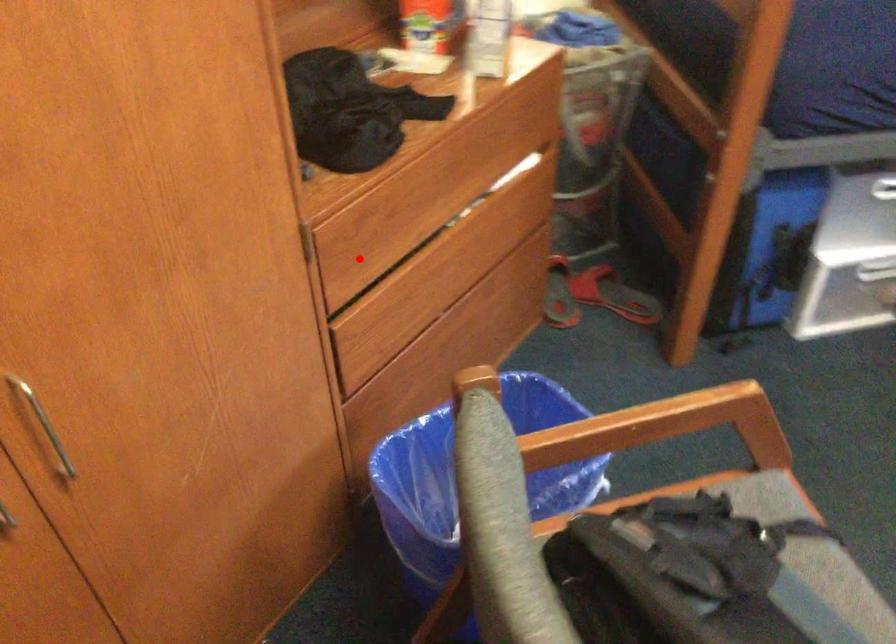
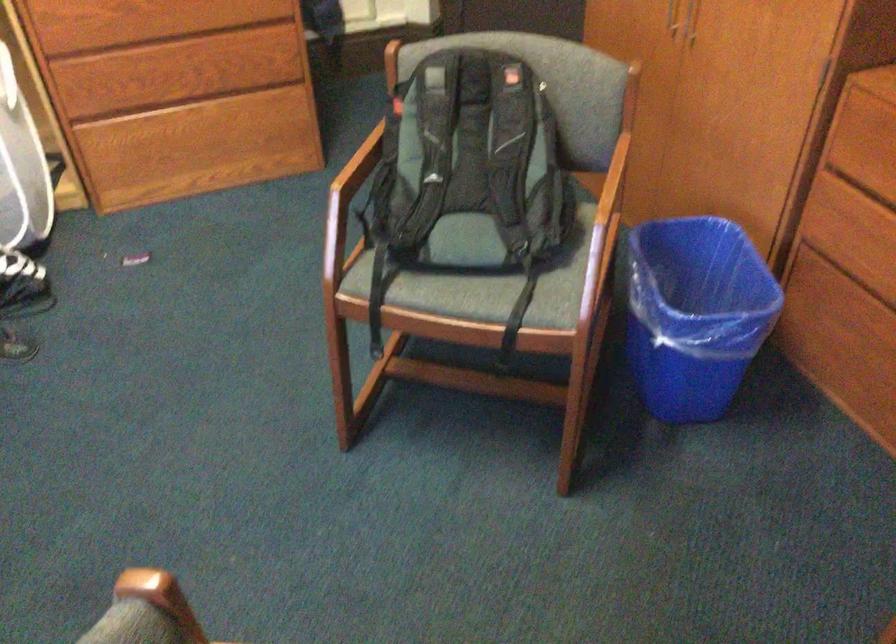
Locate, in the second image, the point that corresponds to the highlighted location in the first image.

(864, 161)